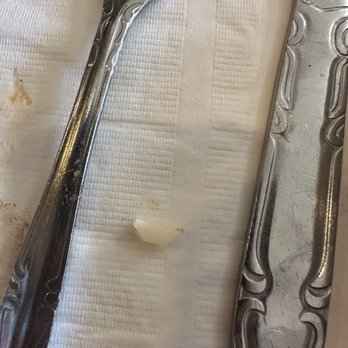
You are a GUI agent. You are given a task and a screenshot of the screen. Output one action in this format:
    pyautogui.click(x=<x>, y=<y>)
    Task: Click on the fork
    This screenshot has width=348, height=348.
    Given the screenshot: What is the action you would take?
    pyautogui.click(x=96, y=86)